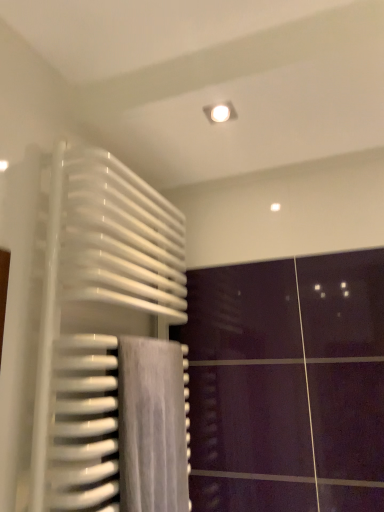
Find the location of a particular element. white glossy radiator at left is located at coordinates (97, 319).

What is the approximate height of white glossy radiator at left?

The height of white glossy radiator at left is 37.89 inches.

What do you see at coordinates (97, 319) in the screenshot? The height and width of the screenshot is (512, 384). I see `white glossy radiator at left` at bounding box center [97, 319].

The width and height of the screenshot is (384, 512). Describe the element at coordinates (152, 426) in the screenshot. I see `gray fabric towel at lower left` at that location.

The height and width of the screenshot is (512, 384). I want to click on gray fabric towel at lower left, so (x=152, y=426).

Image resolution: width=384 pixels, height=512 pixels. Find the location of `white glossy radiator at left`. white glossy radiator at left is located at coordinates (97, 319).

Between white glossy radiator at left and gray fabric towel at lower left, which one appears on the left side from the viewer's perspective?

white glossy radiator at left.

Is white glossy radiator at left in front of gray fabric towel at lower left?

Yes, it is.

Considering the points (82, 484) and (158, 418), which point is in front, point (82, 484) or point (158, 418)?

The point (82, 484) is more forward.

Consider the image. From the image's perspective, which is above, white glossy radiator at left or gray fabric towel at lower left?

white glossy radiator at left is shown above in the image.

From a real-world perspective, who is located higher, white glossy radiator at left or gray fabric towel at lower left?

white glossy radiator at left.

Is white glossy radiator at left wider or thinner than gray fabric towel at lower left?

In the image, white glossy radiator at left appears to be wider than gray fabric towel at lower left.

Considering the sizes of objects white glossy radiator at left and gray fabric towel at lower left in the image provided, who is shorter, white glossy radiator at left or gray fabric towel at lower left?

gray fabric towel at lower left is shorter.

Which of these two, white glossy radiator at left or gray fabric towel at lower left, is bigger?

With larger size is white glossy radiator at left.

Is white glossy radiator at left outside of gray fabric towel at lower left?

Indeed, white glossy radiator at left is completely outside gray fabric towel at lower left.

Are white glossy radiator at left and gray fabric towel at lower left far apart?

They are positioned close to each other.

Is white glossy radiator at left turned away from gray fabric towel at lower left?

Yes, white glossy radiator at left is facing away from gray fabric towel at lower left.

What's the angular difference between white glossy radiator at left and gray fabric towel at lower left's facing directions?

There is a 0.000937-degree angle between the facing directions of white glossy radiator at left and gray fabric towel at lower left.

Where is `radiator in front of the gray fabric towel at lower left`? The image size is (384, 512). radiator in front of the gray fabric towel at lower left is located at coordinates (97, 319).

Which object is positioned more to the right, gray fabric towel at lower left or white glossy radiator at left?

From the viewer's perspective, gray fabric towel at lower left appears more on the right side.

Relative to white glossy radiator at left, is gray fabric towel at lower left in front or behind?

In the image, gray fabric towel at lower left appears behind white glossy radiator at left.

Considering the positions of point (156, 341) and point (123, 249), is point (156, 341) closer or farther from the camera than point (123, 249)?

Point (156, 341) is farther from the camera than point (123, 249).

From the image's perspective, between gray fabric towel at lower left and white glossy radiator at left, who is located below?

gray fabric towel at lower left, from the image's perspective.

From a real-world perspective, is gray fabric towel at lower left below white glossy radiator at left?

Yes, from a real-world perspective, gray fabric towel at lower left is under white glossy radiator at left.

Considering the sizes of objects gray fabric towel at lower left and white glossy radiator at left in the image provided, who is wider, gray fabric towel at lower left or white glossy radiator at left?

A: white glossy radiator at left is wider.

Does gray fabric towel at lower left have a greater height compared to white glossy radiator at left?

Incorrect, the height of gray fabric towel at lower left is not larger of that of white glossy radiator at left.

Between gray fabric towel at lower left and white glossy radiator at left, which one has larger size?

With larger size is white glossy radiator at left.

Is white glossy radiator at left surrounded by gray fabric towel at lower left?

Actually, white glossy radiator at left is outside gray fabric towel at lower left.

Can you see gray fabric towel at lower left touching white glossy radiator at left?

No, gray fabric towel at lower left is not with white glossy radiator at left.

Could you tell me if gray fabric towel at lower left is turned towards white glossy radiator at left?

No, gray fabric towel at lower left is not facing towards white glossy radiator at left.

Locate an element on the screen. The image size is (384, 512). radiator in front of the gray fabric towel at lower left is located at coordinates (97, 319).

In the image, there is a white glossy radiator at left. Where is `bath towel below it (from a real-world perspective)`? Image resolution: width=384 pixels, height=512 pixels. bath towel below it (from a real-world perspective) is located at coordinates (152, 426).

Find the location of `bath towel on the right of white glossy radiator at left`. bath towel on the right of white glossy radiator at left is located at coordinates (152, 426).